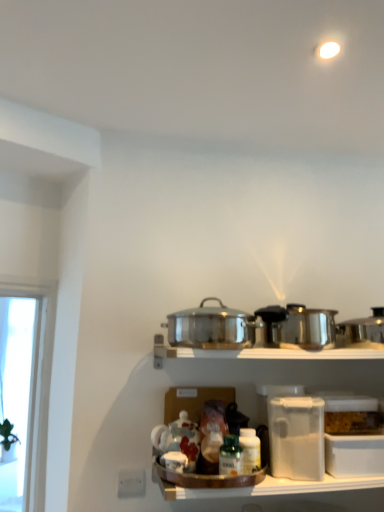
Question: Is shiny metallic crock pot at right, which ranks as the 1th crock pot in right-to-left order, situated inside polished stainless steel pot at center, the second crock pot from the right, or outside?

Choices:
 (A) inside
 (B) outside

Answer: (B)

Question: From the image's perspective, is shiny metallic crock pot at right, which ranks as the 1th crock pot in right-to-left order, positioned above or below polished stainless steel pot at center, the first crock pot from the left?

Choices:
 (A) above
 (B) below

Answer: (B)

Question: Which is farther from the shiny metallic crock pot at right, which ranks as the 1th crock pot in right-to-left order?

Choices:
 (A) clear plastic container at lower right
 (B) polished stainless steel pot at center, the first crock pot from the left
 (C) green glass bottle at center

Answer: (C)

Question: Which is nearer to the shiny metallic crock pot at right, which ranks as the 1th crock pot in right-to-left order?

Choices:
 (A) polished stainless steel pot at center, the first crock pot from the left
 (B) clear plastic container at lower right
 (C) green glass bottle at center

Answer: (B)